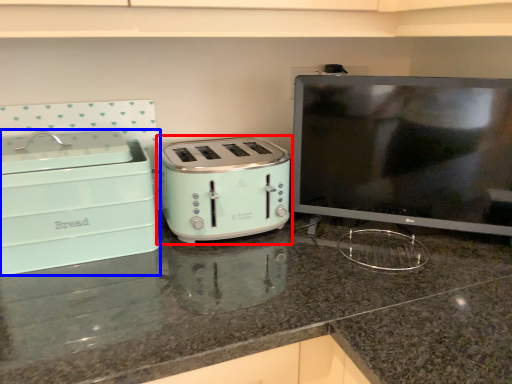
Question: Which object appears closest to the camera in this image, toaster (highlighted by a red box) or home appliance (highlighted by a blue box)?

Choices:
 (A) toaster
 (B) home appliance

Answer: (B)